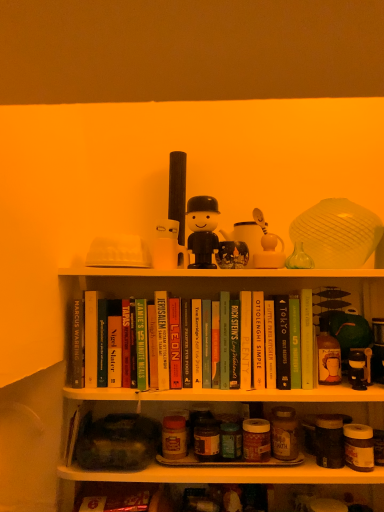
Question: Would you say matte glass jars at lower center is outside hardcover book at center, which ranks as the fourth paperback book in right-to-left order?

Choices:
 (A) yes
 (B) no

Answer: (A)

Question: Considering the relative sizes of matte glass jars at lower center and hardcover book at center, the eleventh paperback book in the left-to-right sequence, in the image provided, is matte glass jars at lower center smaller than hardcover book at center, the eleventh paperback book in the left-to-right sequence,?

Choices:
 (A) yes
 (B) no

Answer: (B)

Question: Is hardcover book at center, which ranks as the fourth paperback book in right-to-left order, surrounded by matte glass jars at lower center?

Choices:
 (A) yes
 (B) no

Answer: (B)

Question: Is matte glass jars at lower center positioned in front of hardcover book at center, the eleventh paperback book in the left-to-right sequence?

Choices:
 (A) no
 (B) yes

Answer: (B)

Question: Is matte glass jars at lower center bigger than hardcover book at center, the eleventh paperback book in the left-to-right sequence?

Choices:
 (A) yes
 (B) no

Answer: (A)

Question: From a real-world perspective, is matte glass jars at lower center beneath hardcover book at center, the eleventh paperback book in the left-to-right sequence?

Choices:
 (A) yes
 (B) no

Answer: (A)

Question: Is hardcover book at center, the eleventh paperback book in the left-to-right sequence, facing away from hardcover book at center, which appears as the 14th paperback book when viewed from the right?

Choices:
 (A) no
 (B) yes

Answer: (A)

Question: From a real-world perspective, does hardcover book at center, which ranks as the fourth paperback book in right-to-left order, stand above hardcover book at center, positioned as the first paperback book in left-to-right order?

Choices:
 (A) yes
 (B) no

Answer: (B)

Question: Can you confirm if hardcover book at center, the eleventh paperback book in the left-to-right sequence, is positioned to the left of hardcover book at center, positioned as the first paperback book in left-to-right order?

Choices:
 (A) no
 (B) yes

Answer: (A)

Question: Is hardcover book at center, which ranks as the fourth paperback book in right-to-left order, far away from hardcover book at center, which appears as the 14th paperback book when viewed from the right?

Choices:
 (A) no
 (B) yes

Answer: (A)

Question: From the image's perspective, is hardcover book at center, the eleventh paperback book in the left-to-right sequence, on top of hardcover book at center, positioned as the first paperback book in left-to-right order?

Choices:
 (A) yes
 (B) no

Answer: (A)

Question: Can you confirm if hardcover book at center, the eleventh paperback book in the left-to-right sequence, is taller than hardcover book at center, positioned as the first paperback book in left-to-right order?

Choices:
 (A) yes
 (B) no

Answer: (B)

Question: Is hardcover book at center, which is counted as the fourth paperback book, starting from the left, touching hardcover book at center, which ranks as the tenth paperback book in right-to-left order?

Choices:
 (A) no
 (B) yes

Answer: (B)